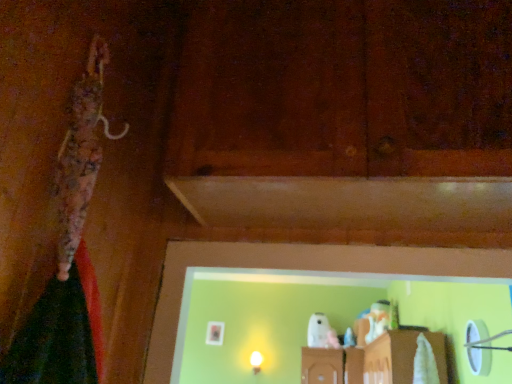
Locate an element on the screen. This screenshot has width=512, height=384. matte white bulb at center is located at coordinates (256, 361).

What do you see at coordinates (256, 361) in the screenshot?
I see `matte white bulb at center` at bounding box center [256, 361].

Measure the distance between point (253,366) and camera.

The distance of point (253,366) from camera is 5.46 meters.

What is the approximate width of matte white bulb at center?

The width of matte white bulb at center is 4.59 inches.

What is the approximate width of brown matte wood at center?

13.14 inches.

This screenshot has height=384, width=512. I want to click on brown matte wood at center, so tap(345, 89).

Image resolution: width=512 pixels, height=384 pixels. Describe the element at coordinates (345, 89) in the screenshot. I see `brown matte wood at center` at that location.

Locate an element on the screen. matte white bulb at center is located at coordinates pyautogui.click(x=256, y=361).

Considering the relative positions of brown matte wood at center and matte white bulb at center in the image provided, is brown matte wood at center to the left of matte white bulb at center from the viewer's perspective?

In fact, brown matte wood at center is to the right of matte white bulb at center.

Which is in front, brown matte wood at center or matte white bulb at center?

brown matte wood at center is closer to the camera.

Does point (437, 169) lie in front of point (256, 365)?

Yes.

From the image's perspective, is brown matte wood at center below matte white bulb at center?

Incorrect, from the image's perspective, brown matte wood at center is higher than matte white bulb at center.

From a real-world perspective, is brown matte wood at center above or below matte white bulb at center?

In terms of real-world spatial position, brown matte wood at center is above matte white bulb at center.

Looking at this image, which object is wider, brown matte wood at center or matte white bulb at center?

With larger width is brown matte wood at center.

Can you confirm if brown matte wood at center is shorter than matte white bulb at center?

In fact, brown matte wood at center may be taller than matte white bulb at center.

Does brown matte wood at center have a smaller size compared to matte white bulb at center?

Incorrect, brown matte wood at center is not smaller in size than matte white bulb at center.

Is brown matte wood at center completely or partially outside of matte white bulb at center?

Yes, brown matte wood at center is located beyond the bounds of matte white bulb at center.

Is brown matte wood at center not near matte white bulb at center?

Indeed, brown matte wood at center is not near matte white bulb at center.

Is brown matte wood at center facing towards matte white bulb at center?

No, brown matte wood at center does not turn towards matte white bulb at center.

How much distance is there between brown matte wood at center and matte white bulb at center?

brown matte wood at center and matte white bulb at center are 16.65 feet apart from each other.

Where is `light fixture lying on the left of brown matte wood at center`? This screenshot has height=384, width=512. light fixture lying on the left of brown matte wood at center is located at coordinates (256, 361).

Considering the relative positions of matte white bulb at center and brown matte wood at center in the image provided, is matte white bulb at center to the right of brown matte wood at center from the viewer's perspective?

In fact, matte white bulb at center is to the left of brown matte wood at center.

Is matte white bulb at center in front of brown matte wood at center?

No, it is behind brown matte wood at center.

Does point (252, 353) come behind point (340, 164)?

Yes, it is.

From the image's perspective, is matte white bulb at center over brown matte wood at center?

No, from the image's perspective, matte white bulb at center is not above brown matte wood at center.

From a real-world perspective, which object stands above the other?

brown matte wood at center, from a real-world perspective.

Which object is thinner, matte white bulb at center or brown matte wood at center?

matte white bulb at center.

Considering the sizes of objects matte white bulb at center and brown matte wood at center in the image provided, who is taller, matte white bulb at center or brown matte wood at center?

brown matte wood at center.

Considering the sizes of objects matte white bulb at center and brown matte wood at center in the image provided, who is bigger, matte white bulb at center or brown matte wood at center?

brown matte wood at center.

Would you say matte white bulb at center contains brown matte wood at center?

No.

Would you consider matte white bulb at center to be distant from brown matte wood at center?

Absolutely, matte white bulb at center is distant from brown matte wood at center.

Is matte white bulb at center positioned with its back to brown matte wood at center?

No.

Locate an element on the screen. The height and width of the screenshot is (384, 512). light fixture located behind the brown matte wood at center is located at coordinates (256, 361).

Locate an element on the screen. The height and width of the screenshot is (384, 512). light fixture below the brown matte wood at center (from the image's perspective) is located at coordinates (256, 361).

Identify the location of wood above the matte white bulb at center (from the image's perspective). (345, 89).